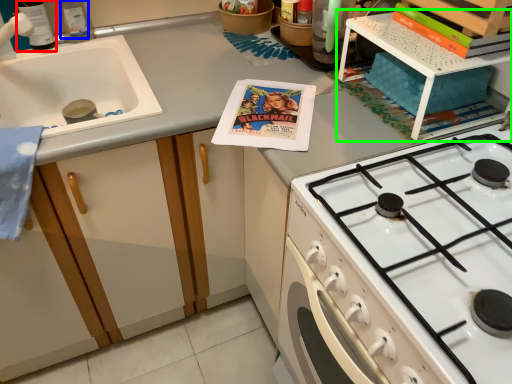
Question: Based on their relative distances, which object is nearer to bottle (highlighted by a red box)? Choose from bottle (highlighted by a blue box) and shelf (highlighted by a green box).

Choices:
 (A) bottle
 (B) shelf

Answer: (A)